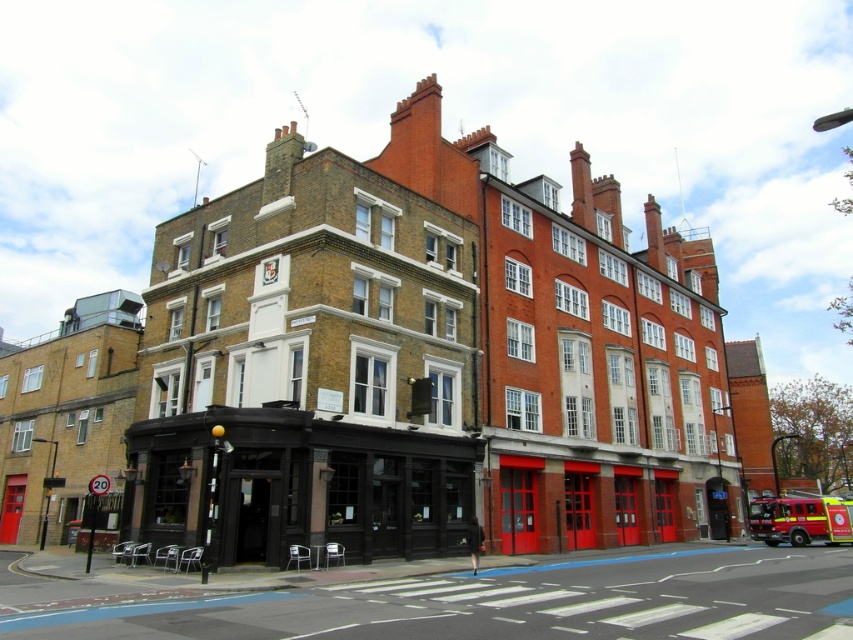
You are a delivery driver who needs to park your truck, which is 20 feet long, between the brick building at left and the red matte fire truck at lower right. Is there enough space for your truck to fit without overlapping either object?

The distance between the brick building at left and the red matte fire truck at lower right is 228.42 feet. Since your truck is only 20 feet long, there is ample space to park it between them without overlapping either object.

What are the coordinates of the brick building at center?

The brick building at center is located at coordinates point (306,369).

You are a delivery person trying to park your van between the brick building at left and the red matte fire truck at lower right. The van is 2 meters wide. Can you fit your van between them?

The brick building at left might be wider than the red matte fire truck at lower right, but the exact width difference isn not specified. Without knowing the exact widths, it is uncertain if the van can fit between them.